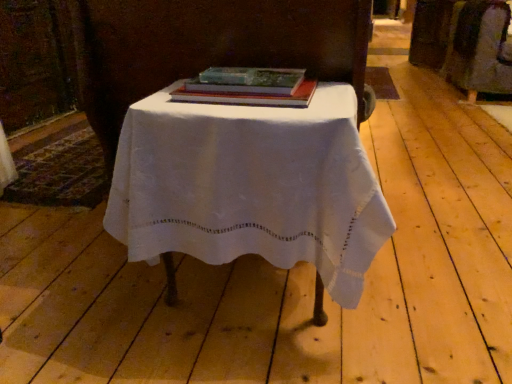
This screenshot has width=512, height=384. Find the location of `free spot to the right of white cloth-covered table at center`. free spot to the right of white cloth-covered table at center is located at coordinates (426, 287).